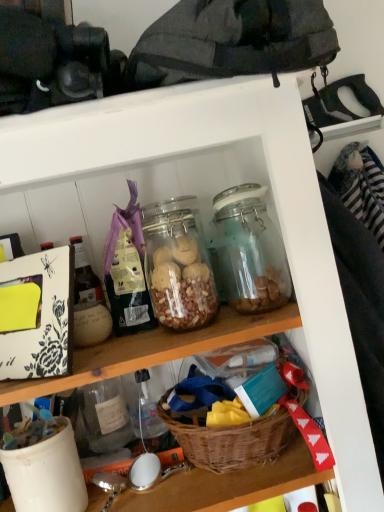
Question: Considering their positions, is woven brown basket at lower center located in front of or behind translucent glass jar at center?

Choices:
 (A) behind
 (B) front

Answer: (B)

Question: Based on their sizes in the image, would you say woven brown basket at lower center is bigger or smaller than translucent glass jar at center?

Choices:
 (A) big
 (B) small

Answer: (A)

Question: Considering the positions of woven brown basket at lower center and translucent glass jar at center in the image, is woven brown basket at lower center taller or shorter than translucent glass jar at center?

Choices:
 (A) short
 (B) tall

Answer: (A)

Question: In terms of width, does translucent glass jar at center look wider or thinner when compared to woven brown basket at lower center?

Choices:
 (A) wide
 (B) thin

Answer: (B)

Question: From the image's perspective, relative to woven brown basket at lower center, is translucent glass jar at center above or below?

Choices:
 (A) above
 (B) below

Answer: (A)

Question: Do you think translucent glass jar at center is within woven brown basket at lower center, or outside of it?

Choices:
 (A) inside
 (B) outside

Answer: (B)

Question: Considering the relative positions of translucent glass jar at center and woven brown basket at lower center in the image provided, is translucent glass jar at center to the left or to the right of woven brown basket at lower center?

Choices:
 (A) left
 (B) right

Answer: (A)